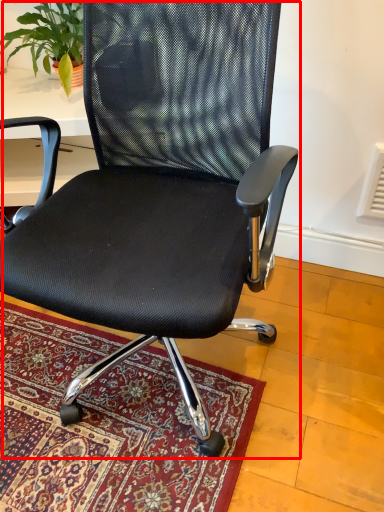
Question: From the image, what is the correct spatial relationship of chair (annotated by the red box) in relation to houseplant?

Choices:
 (A) right
 (B) left

Answer: (A)